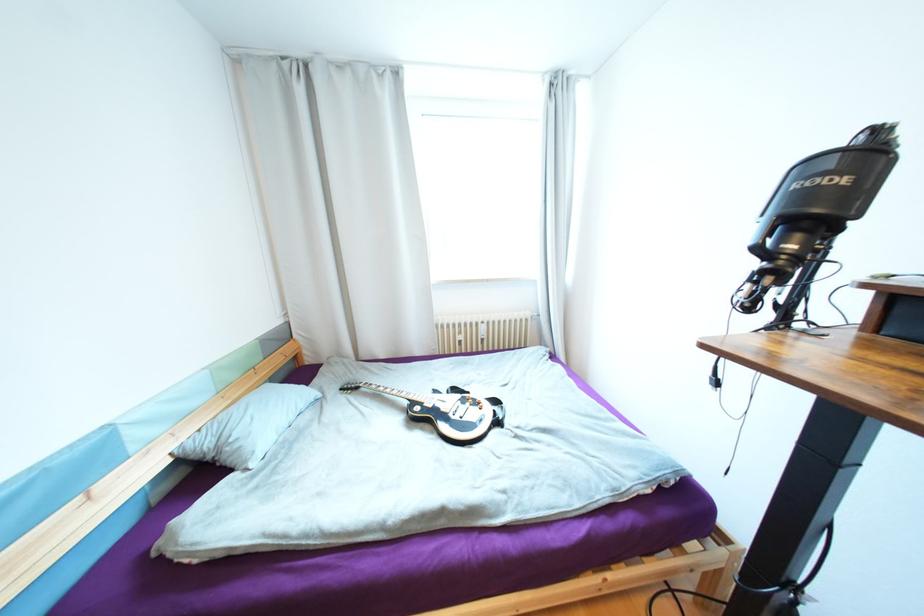
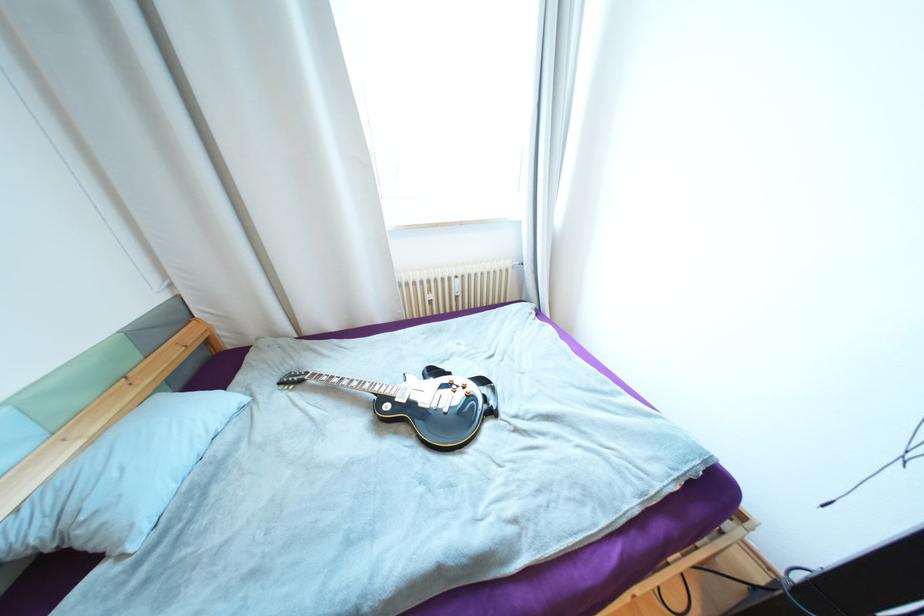
Where in the second image is the point corresponding to the point at 241,447 from the first image?

(101, 525)